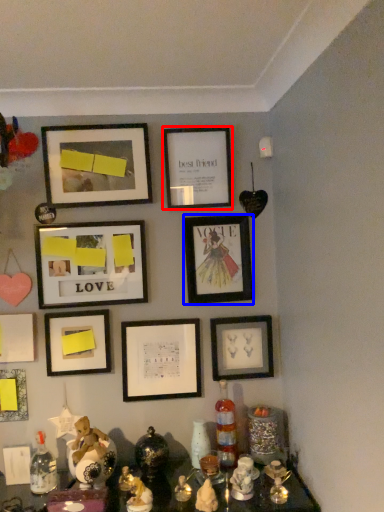
Question: Which of the following is the closest to the observer, picture frame (highlighted by a red box) or picture frame (highlighted by a blue box)?

Choices:
 (A) picture frame
 (B) picture frame

Answer: (A)